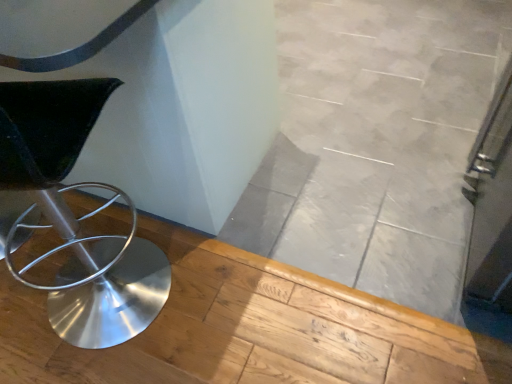
Describe the element at coordinates (79, 218) in the screenshot. The width and height of the screenshot is (512, 384). I see `black leather chair at left` at that location.

Where is `black leather chair at left`? The image size is (512, 384). black leather chair at left is located at coordinates (79, 218).

You are a GUI agent. You are given a task and a screenshot of the screen. Output one action in this format:
    pyautogui.click(x=<x>, y=<y>)
    Task: Click on the black leather chair at left
    The width and height of the screenshot is (512, 384).
    Given the screenshot: What is the action you would take?
    pyautogui.click(x=79, y=218)